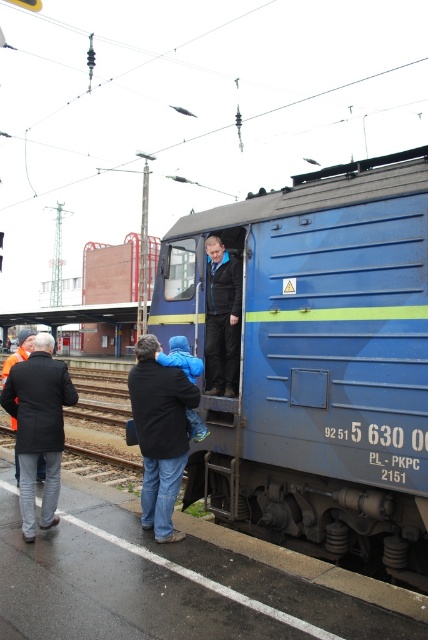
Question: Can you confirm if black fabric jacket at center is positioned below dark gray wool coat at left?

Choices:
 (A) yes
 (B) no

Answer: (A)

Question: Can you confirm if blue matte train at center is bigger than dark gray wool coat at left?

Choices:
 (A) yes
 (B) no

Answer: (A)

Question: Which point is farther to the camera?

Choices:
 (A) click(219, 250)
 (B) click(246, 284)

Answer: (A)

Question: Which object is positioned closest to the dark blue leather jacket at center?

Choices:
 (A) black fabric jacket at center
 (B) blue matte train at center

Answer: (B)

Question: Considering the relative positions of dark gray wool coat at left and dark blue leather jacket at center in the image provided, where is dark gray wool coat at left located with respect to dark blue leather jacket at center?

Choices:
 (A) left
 (B) right

Answer: (A)

Question: Among these objects, which one is nearest to the camera?

Choices:
 (A) dark gray wool coat at left
 (B) blue matte train at center
 (C) dark blue leather jacket at center
 (D) black fabric jacket at center

Answer: (B)